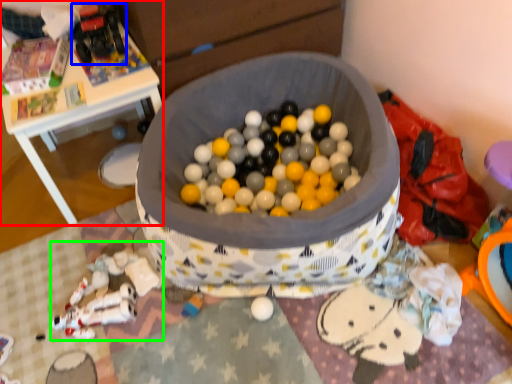
Question: Which object is positioned farthest from table (highlighted by a red box)? Select from toy (highlighted by a blue box) and toy (highlighted by a green box).

Choices:
 (A) toy
 (B) toy

Answer: (B)